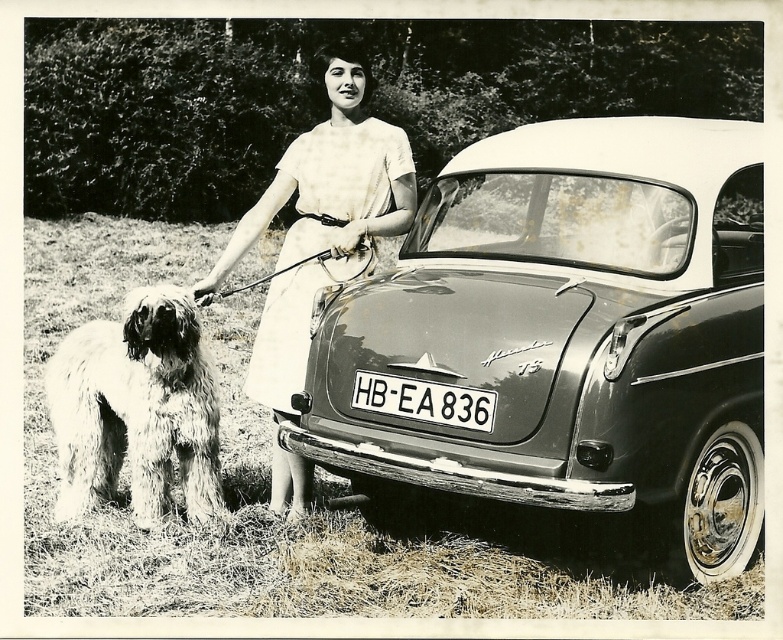
Question: Is white cotton dress at center behind white plastic license plate at center?

Choices:
 (A) yes
 (B) no

Answer: (A)

Question: Which point is closer to the camera?

Choices:
 (A) white plastic license plate at center
 (B) shiny black car at center
 (C) white cotton dress at center
 (D) fuzzy fur dog at lower left

Answer: (B)

Question: Estimate the real-world distances between objects in this image. Which object is closer to the white cotton dress at center?

Choices:
 (A) shiny black car at center
 (B) white plastic license plate at center

Answer: (B)

Question: Is white cotton dress at center to the left of white plastic license plate at center from the viewer's perspective?

Choices:
 (A) yes
 (B) no

Answer: (A)

Question: Considering the relative positions of fuzzy fur dog at lower left and white plastic license plate at center in the image provided, where is fuzzy fur dog at lower left located with respect to white plastic license plate at center?

Choices:
 (A) above
 (B) below

Answer: (B)

Question: Which of these objects is positioned farthest from the fuzzy fur dog at lower left?

Choices:
 (A) white plastic license plate at center
 (B) white cotton dress at center

Answer: (A)